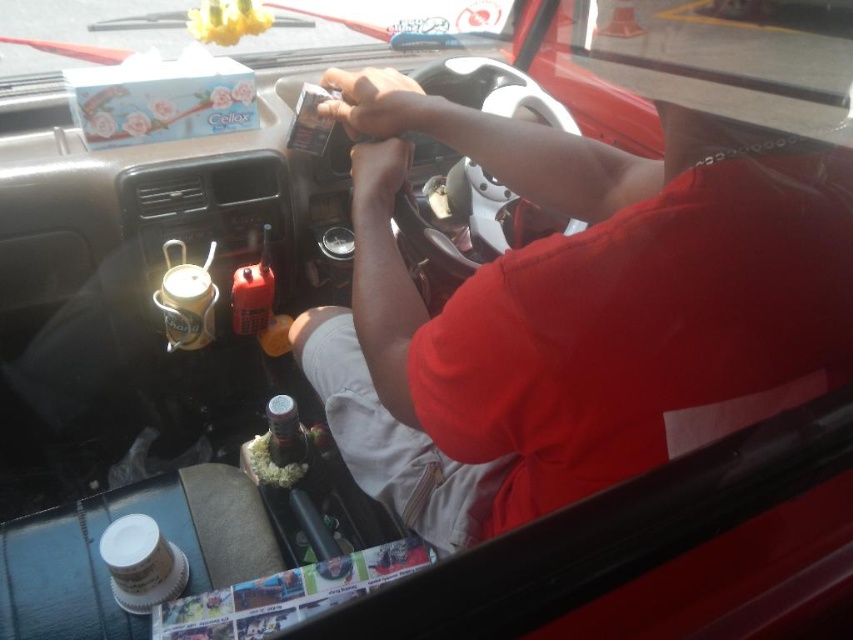
You are a passenger in the car and notice the matte skin hand at center and the white crumbly food at center on the dashboard. Which object is larger in size?

The white crumbly food at center is larger than the matte skin hand at center.

You are a passenger in the car and want to reach for the white crumbly food at center without touching the matte skin hand at center. Is it possible to do so?

The matte skin hand at center is in front of the white crumbly food at center, so you can reach around or behind the hand to access the food without touching it.

You are a passenger in the vehicle and need to place a small item on the dashboard. The driver has a matte skin hand at center. Where should you place the item to avoid blocking the driver?

The matte skin hand at center is located at point (378, 173), so you should place the item away from that coordinate to avoid blocking the driver.